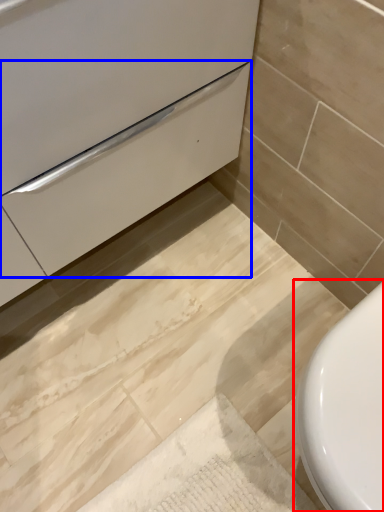
Question: Which point is further to the camera, toilet (highlighted by a red box) or drawer (highlighted by a blue box)?

Choices:
 (A) toilet
 (B) drawer

Answer: (A)